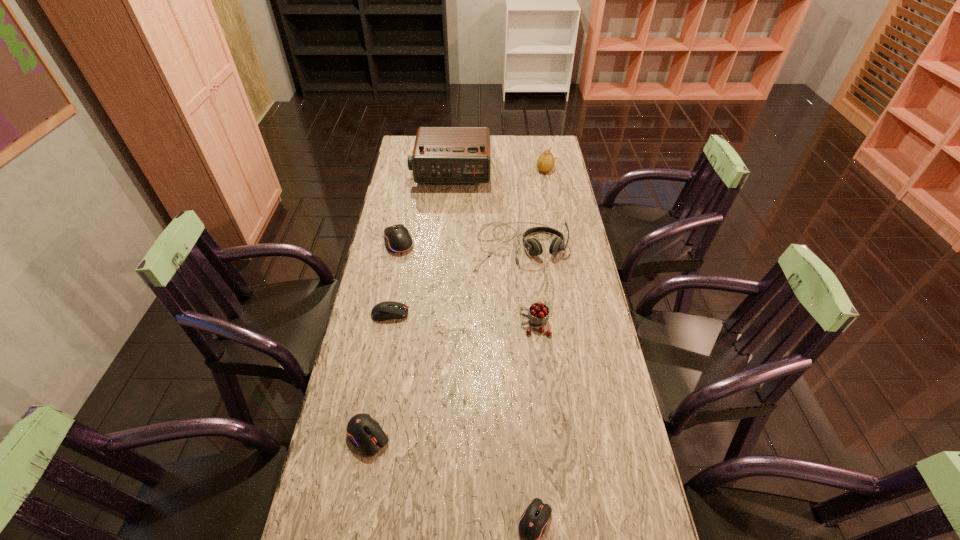
Where is `blank area located on the tuning display of the radio receiver`? This screenshot has height=540, width=960. blank area located on the tuning display of the radio receiver is located at coordinates (444, 252).

The image size is (960, 540). I want to click on free location located on the left of the brown pear, so click(x=494, y=170).

The image size is (960, 540). I want to click on free location located 0.380m on the handle side of the red cherry, so click(x=398, y=325).

You are a GUI agent. You are given a task and a screenshot of the screen. Output one action in this format:
    pyautogui.click(x=<x>, y=<y>)
    Task: Click on the free space located 0.180m on the handle side of the red cherry
    Image resolution: width=960 pixels, height=540 pixels.
    Given the screenshot: What is the action you would take?
    pyautogui.click(x=463, y=325)

Find the location of `free space located on the handle side of the red cherry`. free space located on the handle side of the red cherry is located at coordinates (396, 325).

You are a GUI agent. You are given a task and a screenshot of the screen. Output one action in this format:
    pyautogui.click(x=<x>, y=<y>)
    Task: Click on the blank space located on the outer surface of the headset
    Image resolution: width=960 pixels, height=540 pixels.
    Given the screenshot: What is the action you would take?
    pyautogui.click(x=528, y=337)

This screenshot has height=540, width=960. In order to click on vacant space located on the front of the farthest black computer mouse in this screenshot , I will do `click(384, 318)`.

I want to click on vacant space located 0.170m on the front of the second nearest computer mouse, so click(350, 536).

This screenshot has height=540, width=960. I want to click on vacant space located on the button of the dark computer equipment, so click(x=492, y=313).

I want to click on object situated at the far edge, so click(441, 154).